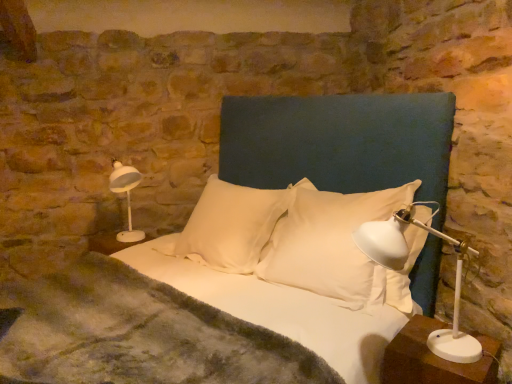
Question: Relative to dark blue fabric headboard at center, is white glossy table lamp at left, which appears as the 1th table lamp when viewed from the left, in front or behind?

Choices:
 (A) front
 (B) behind

Answer: (B)

Question: Visually, is white glossy table lamp at left, which appears as the 1th table lamp when viewed from the left, positioned to the left or to the right of dark blue fabric headboard at center?

Choices:
 (A) left
 (B) right

Answer: (A)

Question: Estimate the real-world distances between objects in this image. Which object is farther from the white glossy table lamp at left, acting as the second table lamp starting from the front?

Choices:
 (A) dark blue fabric headboard at center
 (B) white plastic table lamp at right, arranged as the 1th table lamp when viewed from the right
 (C) white fabric bed at center
 (D) white plastic nightstand at lower right
 (E) white soft pillow at center, positioned as the 2th pillow in right-to-left order

Answer: (D)

Question: Estimate the real-world distances between objects in this image. Which object is farther from the white soft pillow at center, which is the 1th pillow from left to right?

Choices:
 (A) white soft pillow at center, arranged as the 1th pillow when viewed from the right
 (B) white glossy table lamp at left, which appears as the second table lamp when viewed from the right
 (C) white plastic nightstand at lower right
 (D) white fabric bed at center
 (E) dark blue fabric headboard at center

Answer: (C)